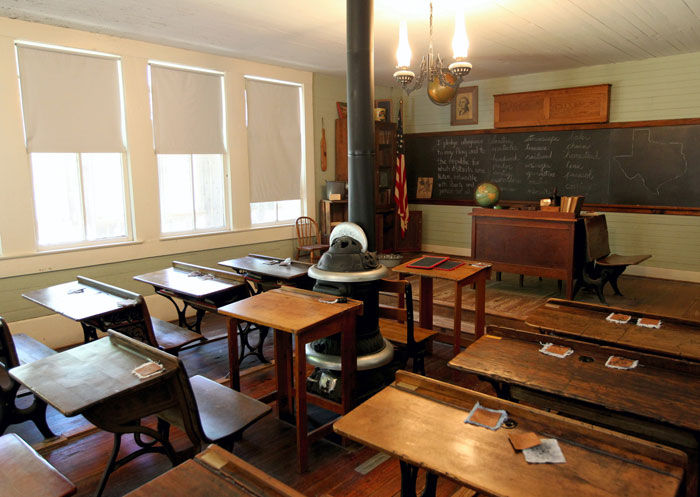
Where is `lights`? lights is located at coordinates (460, 55), (409, 51).